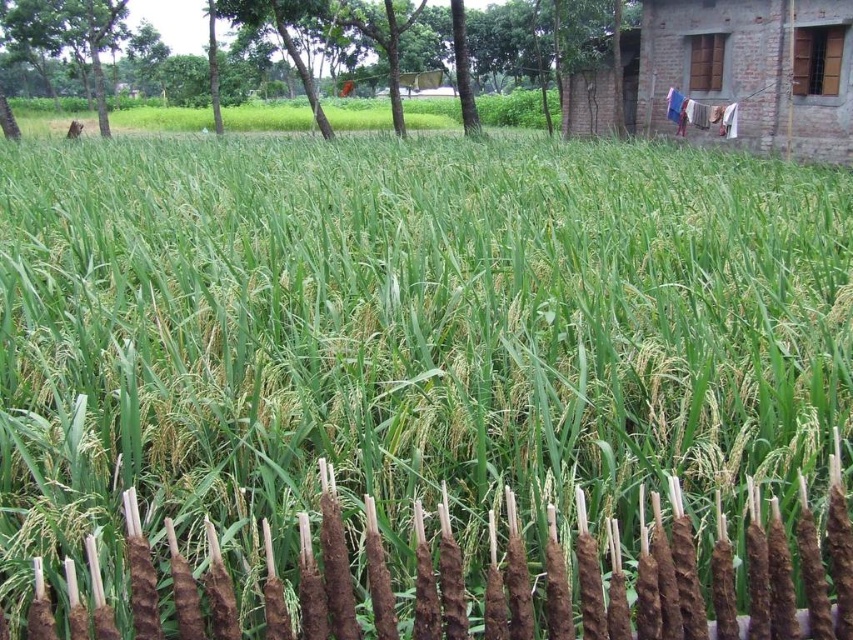
In the scene shown: You are a farmer standing at the edge of your rice field and need to reach the brown brick hut at upper right to fetch tools. There is a brown clay fence at lower center blocking your path. Can you walk around it to get to the hut?

The brown clay fence at lower center is in front of the brown brick hut at upper right, so you can walk around the brown clay fence at lower center to reach the brown brick hut at upper right.

You are a farmer who needs to decide where to place a new scarecrow. The scarecrow requires a spot that is closer to the smaller object between the brown clay fence at lower center and the brown brick hut at upper right. Which object should you choose as the reference point?

The brown clay fence at lower center has a smaller size compared to the brown brick hut at upper right, so you should place the scarecrow closer to the brown clay fence at lower center.

You are a farmer standing at the edge of the rice field. You want to check the distance between you and the brown clay fence at lower center. Can you estimate if it is within your comfortable walking distance?

The brown clay fence at lower center is 1.03 meters away from you, which is a very short distance, so it is well within your comfortable walking range.